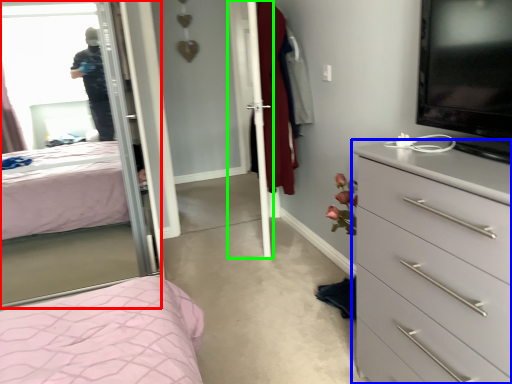
Question: Based on their relative distances, which object is farther from mirror (highlighted by a red box)? Choose from chest of drawers (highlighted by a blue box) and screen door (highlighted by a green box).

Choices:
 (A) chest of drawers
 (B) screen door

Answer: (B)